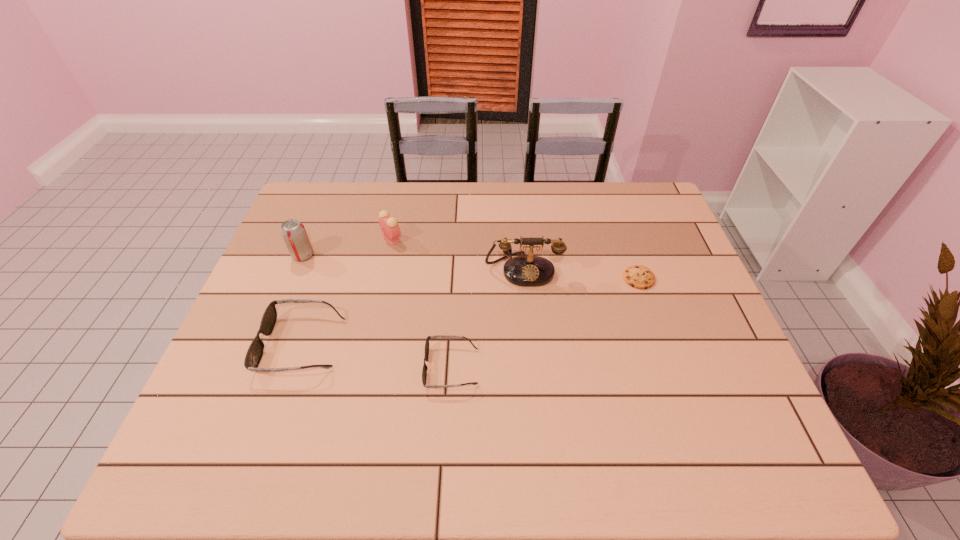
Find the location of a particular element. vacant region located 0.130m on the front-facing side of the fifth tallest object is located at coordinates (370, 367).

The width and height of the screenshot is (960, 540). I want to click on vacant region located on the front-facing side of the fifth tallest object, so [x=281, y=367].

I want to click on vacant space located 0.060m on the front-facing side of the fifth tallest object, so click(x=399, y=367).

Locate an element on the screen. free point located 0.170m on the face of the fourth shortest object is located at coordinates (458, 238).

Locate an element on the screen. This screenshot has height=540, width=960. free location located 0.050m on the front of the soda can is located at coordinates [295, 275].

Where is `free space located 0.380m on the left of the shortest object`? This screenshot has width=960, height=540. free space located 0.380m on the left of the shortest object is located at coordinates (489, 278).

Identify the location of vacant space located on the dial of the telephone. (531, 354).

Locate an element on the screen. This screenshot has width=960, height=540. object that is at the near edge is located at coordinates (424, 371).

What are the coordinates of `sunglasses that is at the left edge` in the screenshot? It's located at pos(254,354).

I want to click on soda can present at the left edge, so click(x=294, y=234).